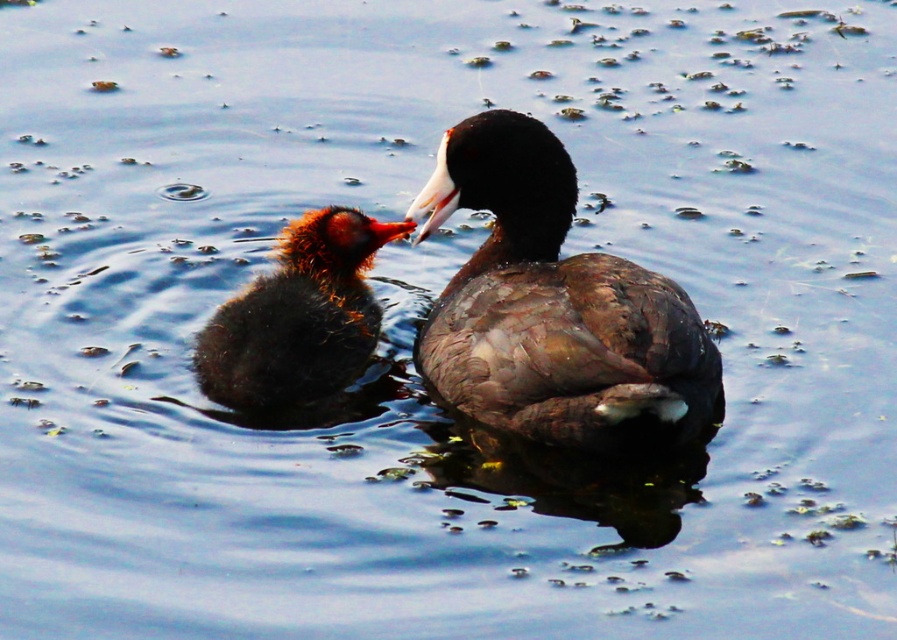
Question: Can you confirm if brown feathered duckling at center is wider than brown downy duckling at center?

Choices:
 (A) no
 (B) yes

Answer: (B)

Question: Is brown feathered duckling at center to the left of brown downy duckling at center from the viewer's perspective?

Choices:
 (A) no
 (B) yes

Answer: (A)

Question: Which of the following is the closest to the observer?

Choices:
 (A) brown feathered duckling at center
 (B) brown downy duckling at center

Answer: (A)

Question: Does brown feathered duckling at center appear over brown downy duckling at center?

Choices:
 (A) yes
 (B) no

Answer: (A)